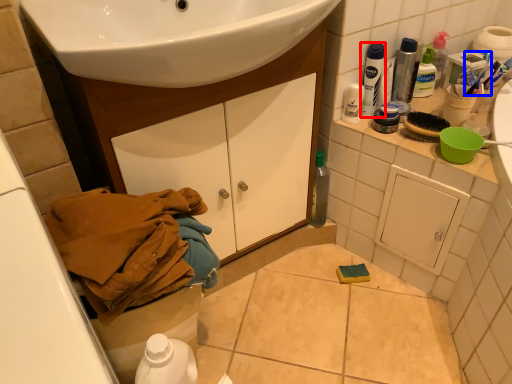
Question: Which object appears closest to the camera in this image, mouthwash (highlighted by a red box) or toothbrush (highlighted by a blue box)?

Choices:
 (A) mouthwash
 (B) toothbrush

Answer: (A)